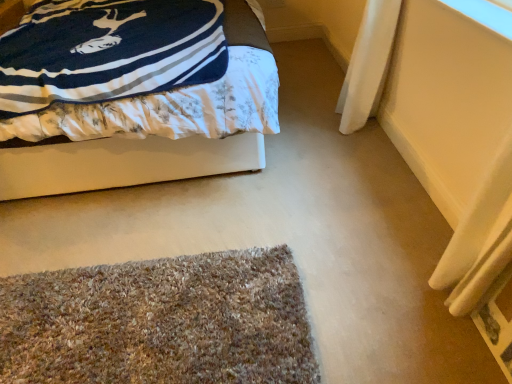
You are a GUI agent. You are given a task and a screenshot of the screen. Output one action in this format:
    pyautogui.click(x=<x>, y=<y>)
    Task: Click on the vacant space to the right of multicolored shaggy mat at lower center
    
    Given the screenshot: What is the action you would take?
    pyautogui.click(x=353, y=260)